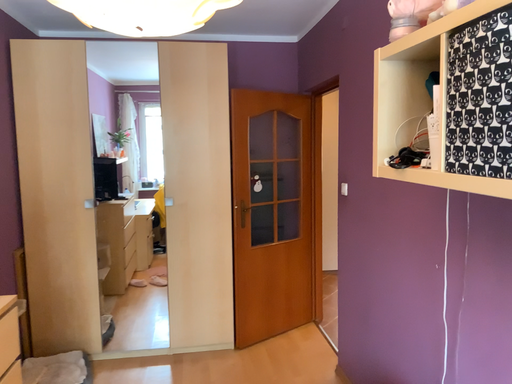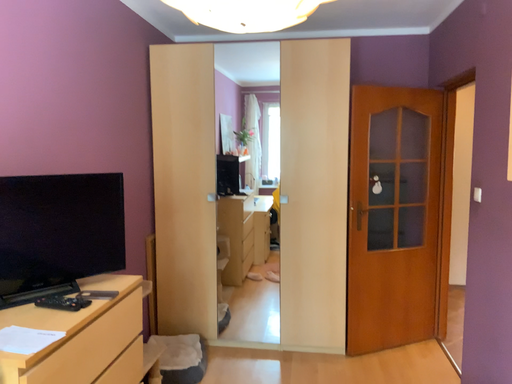
Question: Which way did the camera rotate in the video?

Choices:
 (A) rotated left
 (B) rotated right

Answer: (A)